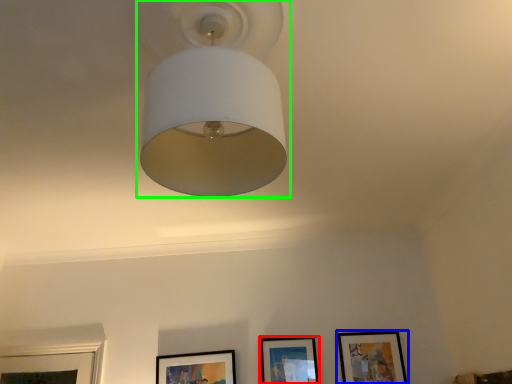
Question: Considering the real-world distances, which object is closest to picture frame (highlighted by a red box)? picture frame (highlighted by a blue box) or lamp (highlighted by a green box).

Choices:
 (A) picture frame
 (B) lamp

Answer: (A)